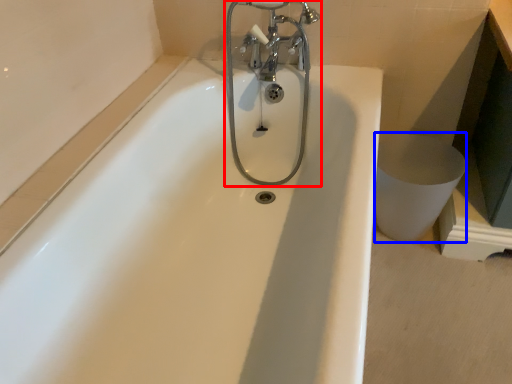
Question: Which object is further to the camera taking this photo, tap (highlighted by a red box) or toilet bowl (highlighted by a blue box)?

Choices:
 (A) tap
 (B) toilet bowl

Answer: (B)